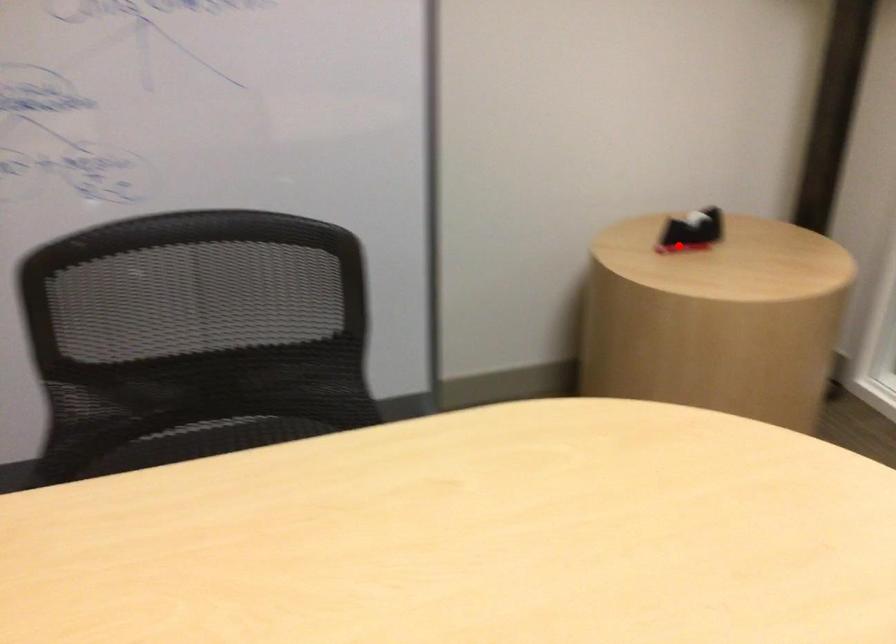
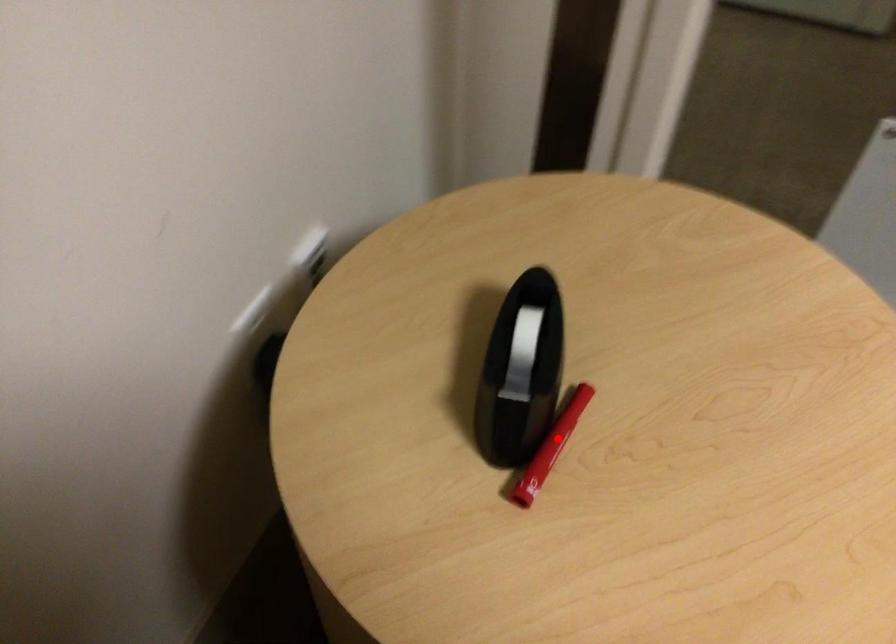
I am providing you with two images of the same scene from different viewpoints. A red point is marked on the first image and another point is marked on the second image. Do the highlighted points in image1 and image2 indicate the same real-world spot?

Yes